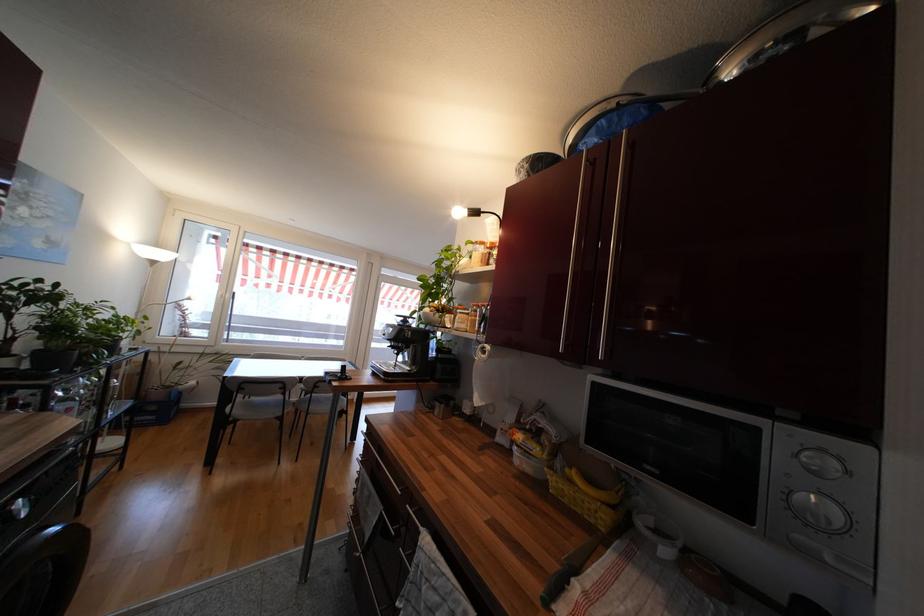
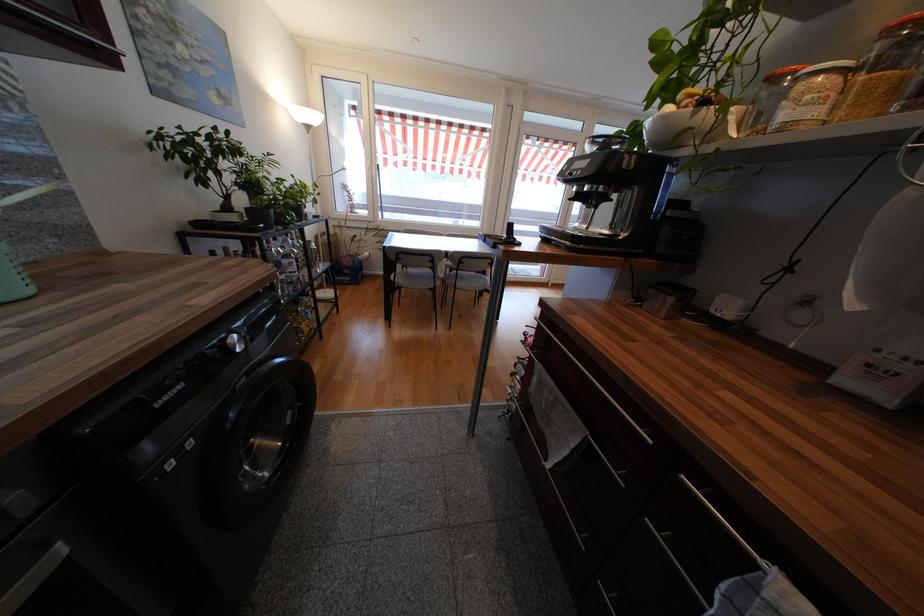
Based on the continuous images, in which direction is the camera rotating?

The camera rotated toward left-down.